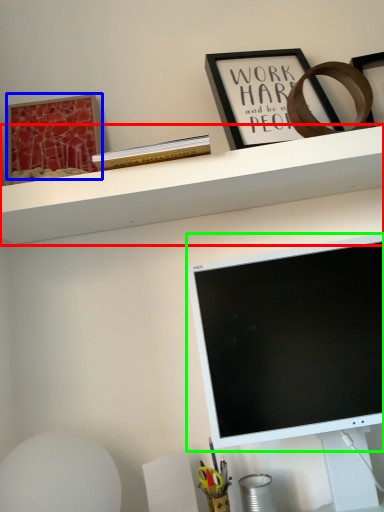
Question: Which is farther away from shelf (highlighted by a red box)? picture frame (highlighted by a blue box) or computer monitor (highlighted by a green box)?

Choices:
 (A) picture frame
 (B) computer monitor

Answer: (A)